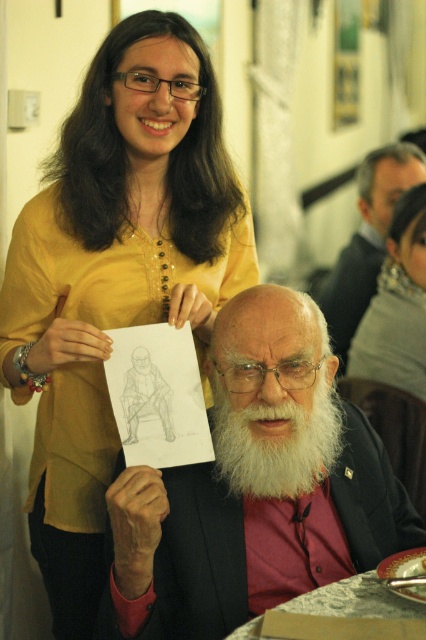
You are an artist analyzing the composition of this image. You notice the white beard at center and the gray hair at upper center. Which of these two elements takes up more visual space in the image?

The gray hair at upper center takes up more visual space than the white beard at center.